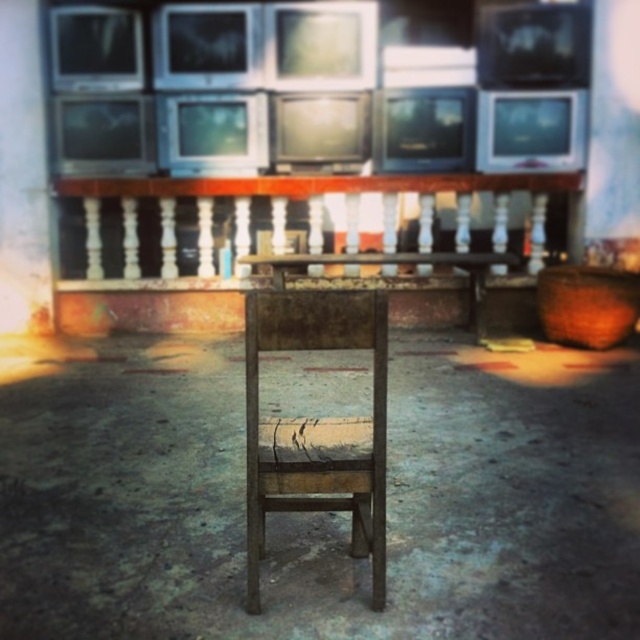
You are a painter who needs to decide which object to paint first. The white wooden balustrade at center and the rusty metal chair at center are both in your view. Which object requires more paint because it has a larger surface area?

The white wooden balustrade at center requires more paint because it is bigger than the rusty metal chair at center.

You are standing in the abandoned space and want to sit on the rusty metal chair at center. Can you reach it without moving the white wooden balustrade at center?

The rusty metal chair at center is behind the white wooden balustrade at center, so you cannot reach it without moving the balustrade first.

You are standing in the abandoned outdoor area and want to move from the weathered chair to the row of old television sets. Which point, point (452, 173) or point (248, 323), is closer to you as you start moving towards the televisions?

Point (452, 173) is further to the viewer than point (248, 323). Therefore, point (248, 323) is closer to you as you start moving towards the televisions.